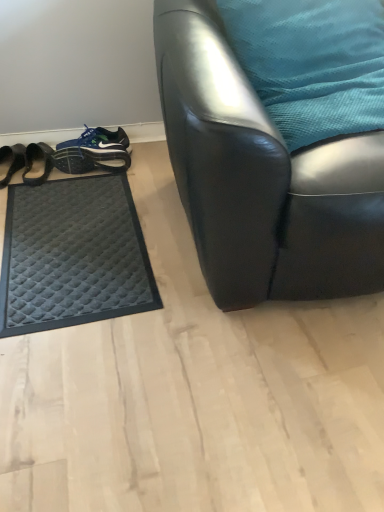
Question: Is blue fabric shoe at lower left, the second footwear in the left-to-right sequence, shorter than black quilted mat at left, which is the 1th footwear from left to right?

Choices:
 (A) no
 (B) yes

Answer: (A)

Question: Is black quilted mat at left, the second footwear from the right, a part of blue fabric shoe at lower left, the second footwear in the left-to-right sequence?

Choices:
 (A) no
 (B) yes

Answer: (A)

Question: Can you confirm if blue fabric shoe at lower left, the second footwear in the left-to-right sequence, is smaller than black quilted mat at left, which is the 1th footwear from left to right?

Choices:
 (A) yes
 (B) no

Answer: (A)

Question: From a real-world perspective, is blue fabric shoe at lower left, the second footwear in the left-to-right sequence, located beneath black quilted mat at left, the second footwear from the right?

Choices:
 (A) no
 (B) yes

Answer: (A)

Question: From a real-world perspective, is blue fabric shoe at lower left, the second footwear in the left-to-right sequence, physically above black quilted mat at left, the second footwear from the right?

Choices:
 (A) yes
 (B) no

Answer: (A)

Question: Can we say blue fabric shoe at lower left, which appears as the first footwear when viewed from the right, lies outside black quilted mat at left, which is the 1th footwear from left to right?

Choices:
 (A) yes
 (B) no

Answer: (A)

Question: Is blue fabric shoe at lower left, the second footwear in the left-to-right sequence, facing away from black quilted mat at lower left?

Choices:
 (A) yes
 (B) no

Answer: (B)

Question: Can you confirm if blue fabric shoe at lower left, the second footwear in the left-to-right sequence, is wider than black quilted mat at lower left?

Choices:
 (A) yes
 (B) no

Answer: (B)

Question: Does blue fabric shoe at lower left, which appears as the first footwear when viewed from the right, have a larger size compared to black quilted mat at lower left?

Choices:
 (A) yes
 (B) no

Answer: (B)

Question: Does blue fabric shoe at lower left, which appears as the first footwear when viewed from the right, have a smaller size compared to black quilted mat at lower left?

Choices:
 (A) yes
 (B) no

Answer: (A)

Question: Are blue fabric shoe at lower left, which appears as the first footwear when viewed from the right, and black quilted mat at lower left located far from each other?

Choices:
 (A) no
 (B) yes

Answer: (A)

Question: Can you confirm if blue fabric shoe at lower left, the second footwear in the left-to-right sequence, is thinner than black quilted mat at lower left?

Choices:
 (A) yes
 (B) no

Answer: (A)

Question: Considering the relative sizes of teal fabric pillow at upper right and black leather chair at center in the image provided, is teal fabric pillow at upper right smaller than black leather chair at center?

Choices:
 (A) no
 (B) yes

Answer: (B)